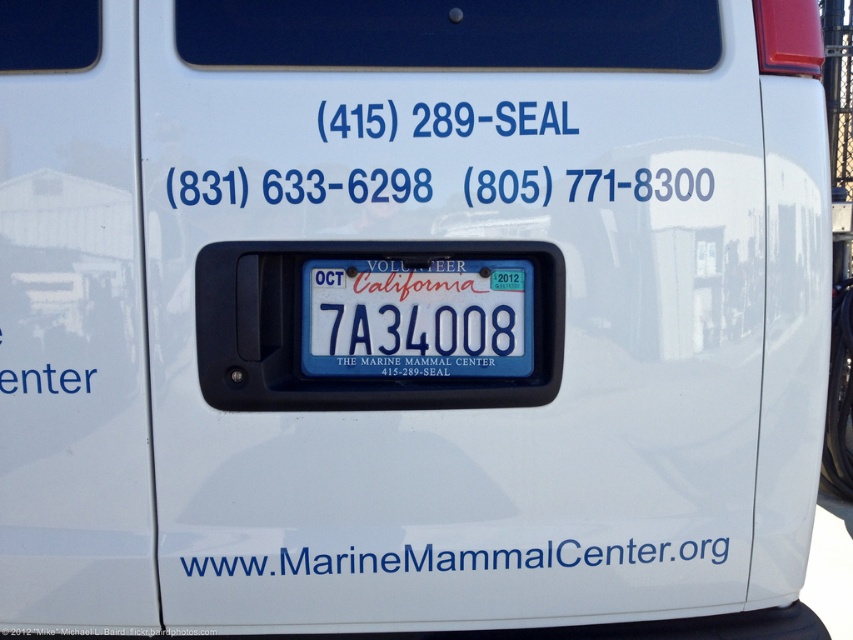
Does blue plastic license plate at center have a smaller size compared to white plastic text at lower center?

Yes.

Between point (456, 305) and point (549, 547), which one is positioned in front?

Positioned in front is point (456, 305).

At what (x,y) coordinates should I click in order to perform the action: click on blue plastic license plate at center. Please return your answer as a coordinate pair (x, y). This screenshot has height=640, width=853. Looking at the image, I should click on (416, 317).